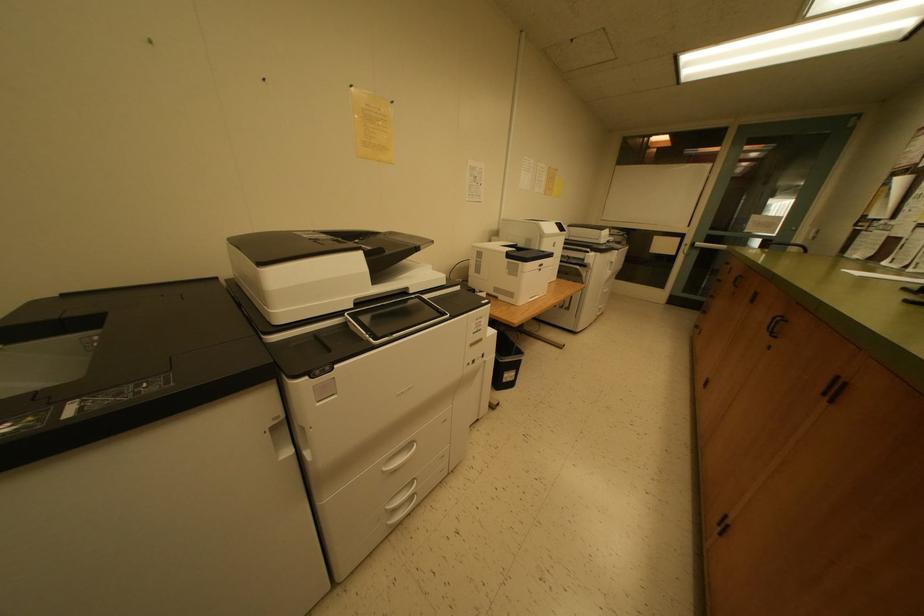
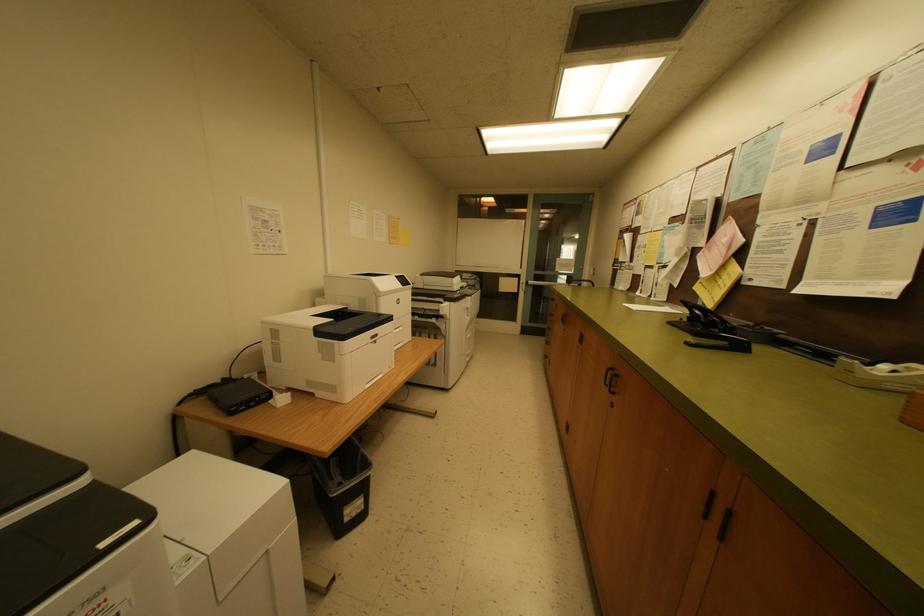
Question: How did the camera likely rotate?

Choices:
 (A) Left
 (B) Right
 (C) Up
 (D) Down

Answer: (B)